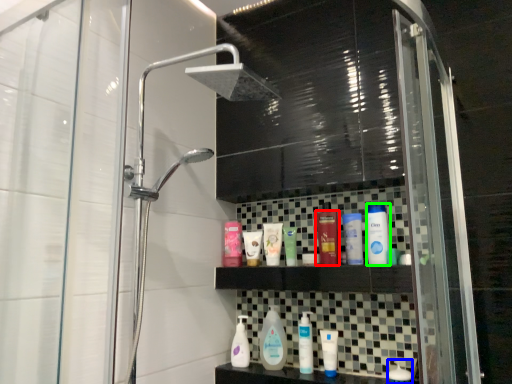
Question: Based on their relative distances, which object is farther from toiletry (highlighted by a red box)? Choose from toiletry (highlighted by a blue box) and toiletry (highlighted by a green box).

Choices:
 (A) toiletry
 (B) toiletry

Answer: (A)